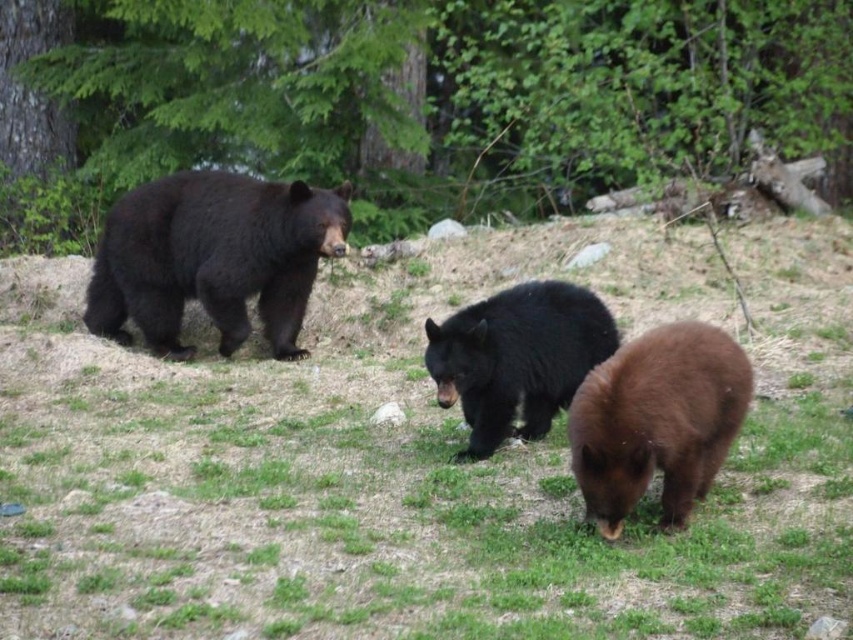
Between brown furry bear at lower right and brown furry bear at center, which one has less height?

brown furry bear at lower right

Does brown furry bear at lower right have a lesser height compared to brown furry bear at center?

Yes.

Is point (608, 426) positioned before point (549, 428)?

Yes, point (608, 426) is closer to viewer.

Identify the location of brown furry bear at lower right. This screenshot has height=640, width=853. (657, 420).

Which is more to the right, shiny dark brown bear at left or brown furry bear at center?

From the viewer's perspective, brown furry bear at center appears more on the right side.

In the scene shown: Does shiny dark brown bear at left come in front of brown furry bear at center?

No.

Based on the photo, who is more forward, (99, 237) or (556, 380)?

Point (556, 380) is in front.

Where is `shiny dark brown bear at left`? The image size is (853, 640). shiny dark brown bear at left is located at coordinates (213, 257).

Which is above, green grassy at upper center or brown furry bear at lower right?

brown furry bear at lower right is above.

Who is more forward, (621, 227) or (682, 500)?

Point (682, 500) is in front.

Find the location of a particular element. green grassy at upper center is located at coordinates (415, 461).